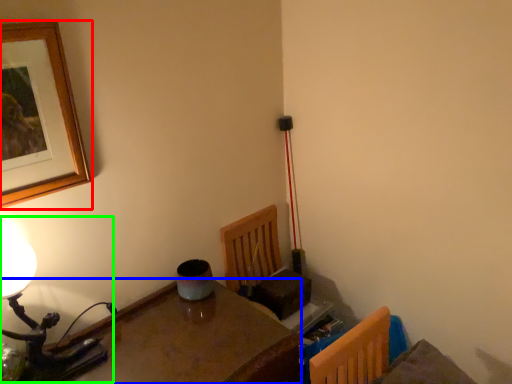
Question: Considering the real-world distances, which object is farthest from picture frame (highlighted by a red box)? table (highlighted by a blue box) or table lamp (highlighted by a green box)?

Choices:
 (A) table
 (B) table lamp

Answer: (A)